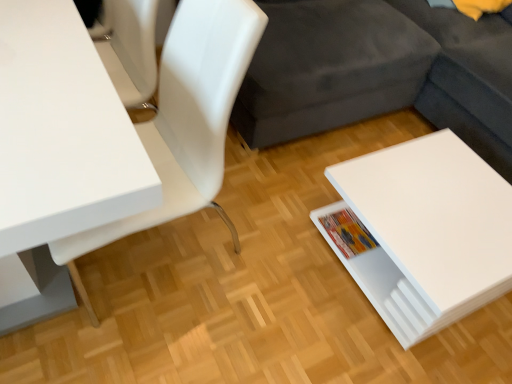
Identify the location of vacant area that is situated to the right of white glossy chair at upper left. This screenshot has width=512, height=384. (274, 277).